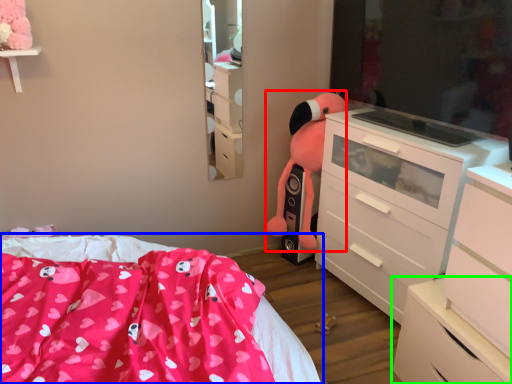
Question: Which is nearer to the animal (highlighted by a red box)? bed (highlighted by a blue box) or chest of drawers (highlighted by a green box).

Choices:
 (A) bed
 (B) chest of drawers

Answer: (A)